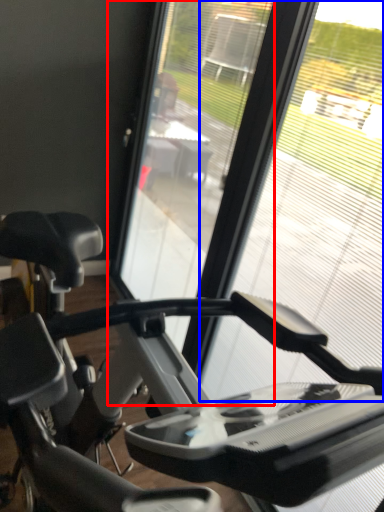
Question: Which of the following is the farthest to the observer, screen door (highlighted by a red box) or glass window (highlighted by a blue box)?

Choices:
 (A) screen door
 (B) glass window

Answer: (A)